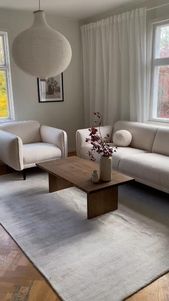
The width and height of the screenshot is (169, 301). I want to click on window by chair, so click(2, 109).